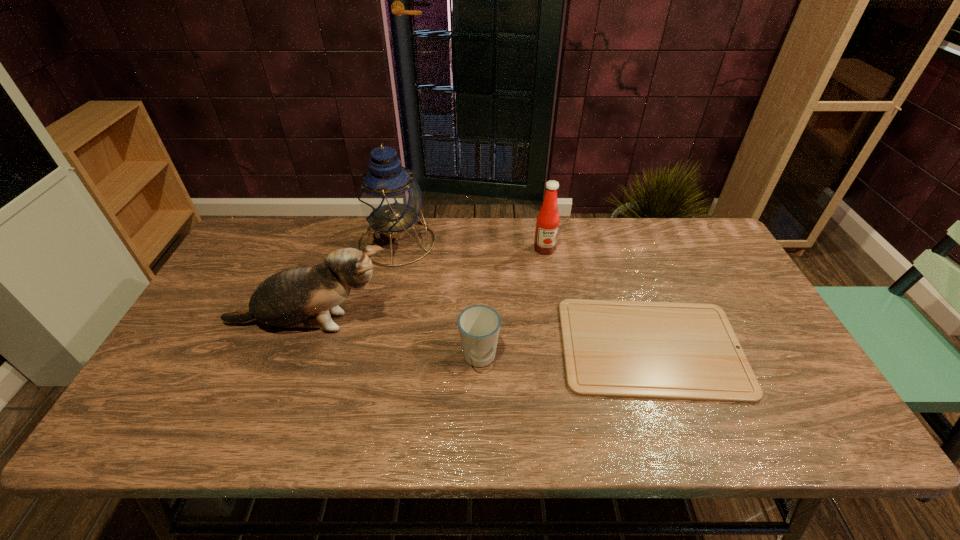
Where is `vacant space located on the front of the chopping board`? The height and width of the screenshot is (540, 960). vacant space located on the front of the chopping board is located at coordinates (680, 427).

Where is `lantern present at the far edge`? lantern present at the far edge is located at coordinates (389, 198).

Locate an element on the screen. This screenshot has width=960, height=540. condiment located at the far edge is located at coordinates (547, 225).

At what (x,y) coordinates should I click in order to perform the action: click on object present at the left edge. Please return your answer as a coordinate pair (x, y). This screenshot has width=960, height=540. Looking at the image, I should click on (287, 299).

Locate an element on the screen. The image size is (960, 540). object that is at the right edge is located at coordinates (634, 349).

In the image, there is a desktop. Identify the location of vacant space at the far edge. The height and width of the screenshot is (540, 960). click(x=328, y=245).

In the image, there is a desktop. Find the location of `vacant space at the near edge`. vacant space at the near edge is located at coordinates (669, 420).

The height and width of the screenshot is (540, 960). Identify the location of vacant space at the near left corner. (162, 428).

Find the location of `vacant area at the far right corner`. vacant area at the far right corner is located at coordinates (727, 262).

Locate an element on the screen. The width and height of the screenshot is (960, 540). unoccupied position between the condiment and the tallest object is located at coordinates (470, 245).